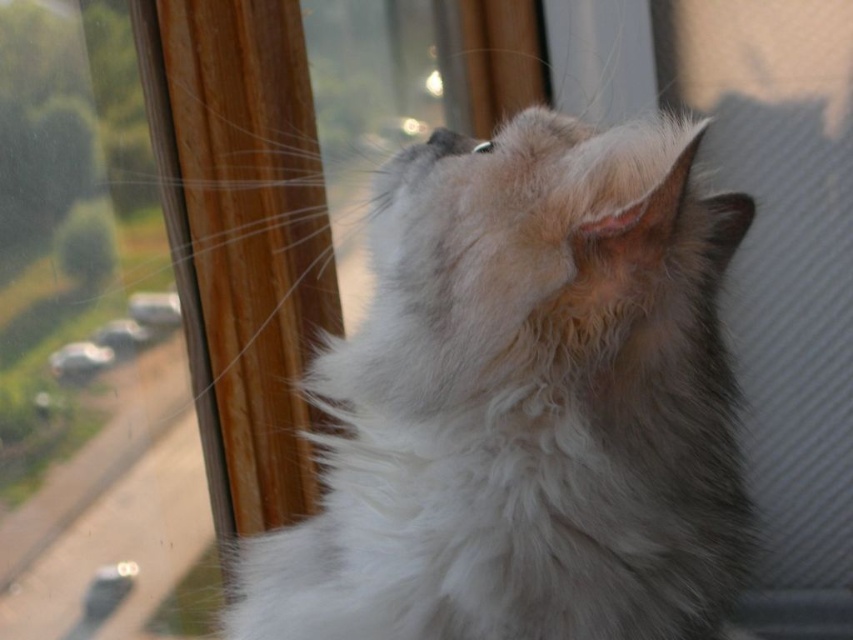
You are a photographer trying to capture the white fluffy cat at center and the black fur nose at center in a single shot. Based on their positions, which one is closer to the camera?

The black fur nose at center is closer to the camera because the white fluffy cat at center is positioned to the right of it, meaning the nose is in front.

You are a photographer trying to capture the white fluffy cat at center and the black fur nose at center in a portrait. Since you want to highlight the cat, which object should you focus on to ensure it appears larger in the photo?

The white fluffy cat at center has a greater height compared to the black fur nose at center, so focusing on the white fluffy cat at center will make it appear larger in the photo.

You are a delivery robot that is 12 inches wide. You are approaching the point marked at coordinates point (656, 305). The distance between you and the point is 38.09 inches. Can you safely navigate to that point without getting too close to the cat?

The distance between you and the point marked at coordinates point (656, 305) is 38.09 inches. Since you are 12 inches wide, you can safely navigate to that point as long as you maintain a path that keeps you at least 6 inches away from the cat to avoid disturbing it.